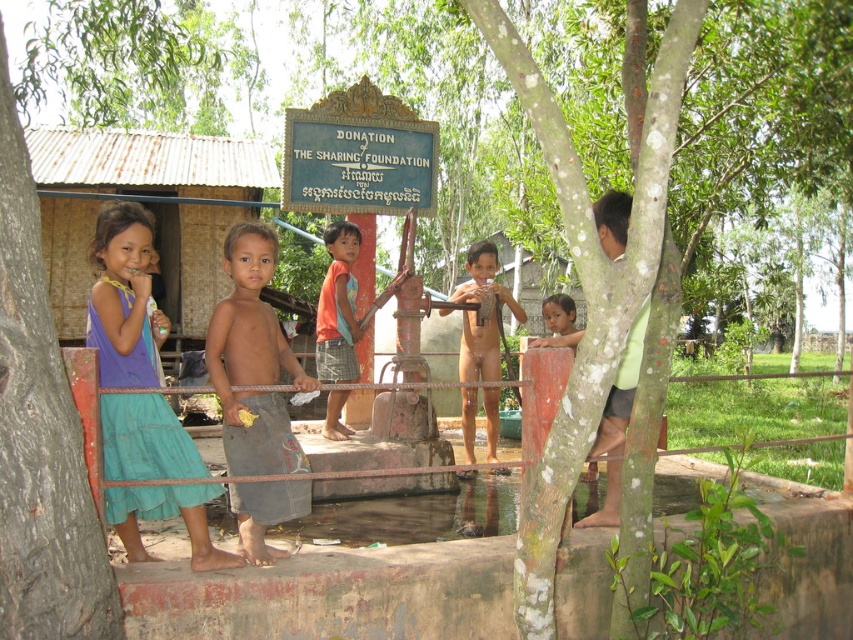
You are a photographer aiming to capture a closeup of the orange fabric shirt at center. Based on its coordinates, where should you position your camera relative to the image frame?

The orange fabric shirt at center is located at coordinates point (338, 307), so you should position your camera to focus on the center of the image frame.

You are a photographer trying to capture a photo of the white textured tree at center and the orange fabric shirt at center. Which object should you zoom in on to ensure both are in frame without moving the camera?

The white textured tree at center is wider than the orange fabric shirt at center. To include both in the frame without moving the camera, you should zoom in on the orange fabric shirt at center since it is narrower and will fit within the same field of view as the wider tree.

Based on the scene description, which of the two points, point 1 at coordinates (157, 412) or point 2 at (550, 314), is closer to the viewer?

Point 1 at coordinates (157, 412) is closer to the viewer because it is in front of point 2 at (550, 314) according to the spatial description.